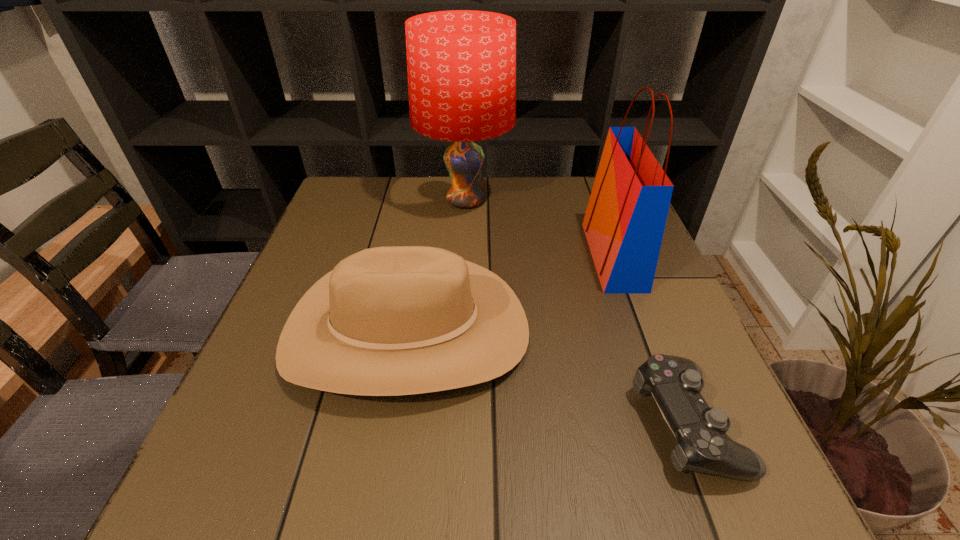
You are a GUI agent. You are given a task and a screenshot of the screen. Output one action in this format:
    pyautogui.click(x=<x>, y=<y>)
    Task: Click on the lampshade
    The height and width of the screenshot is (540, 960).
    Given the screenshot: What is the action you would take?
    pyautogui.click(x=461, y=64)

I want to click on shopping bag, so click(x=624, y=223).

The height and width of the screenshot is (540, 960). I want to click on cowboy hat, so click(398, 320).

Identify the location of control. 702,445.

Find the location of `vacant space located on the front-facing side of the lampshade`. vacant space located on the front-facing side of the lampshade is located at coordinates (588, 201).

At what (x,y) coordinates should I click in order to perform the action: click on free space located 0.280m on the handle side of the shopping bag. Please return your answer as a coordinate pair (x, y). Looking at the image, I should click on (469, 256).

Identify the location of blank area located 0.110m on the handle side of the shopping bag. (543, 256).

Identify the location of free region located 0.350m on the handle side of the shopping bag. (440, 256).

Locate an element on the screen. vacant space located 0.140m on the front of the cowboy hat is located at coordinates (376, 506).

The height and width of the screenshot is (540, 960). Identify the location of vacant space located on the back of the shortest object. (638, 300).